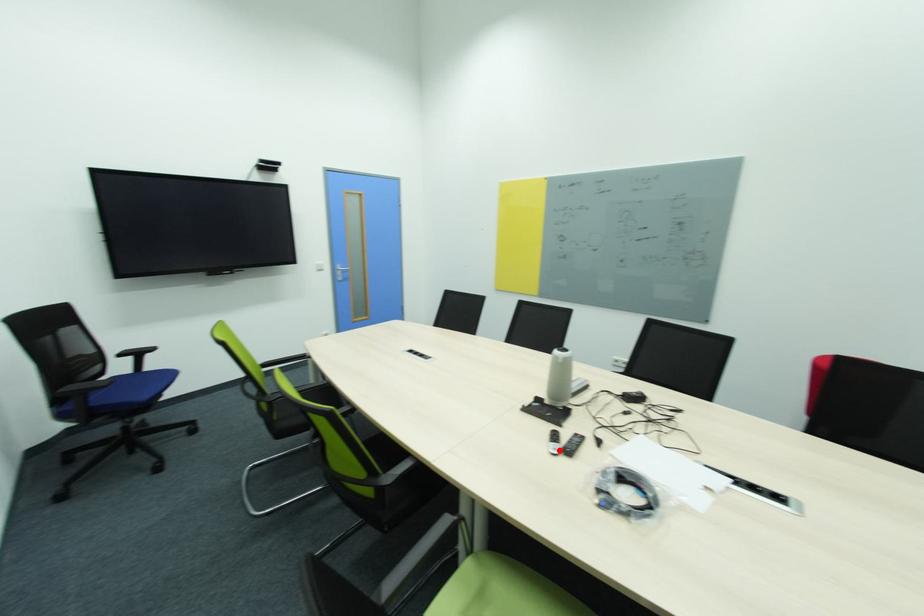
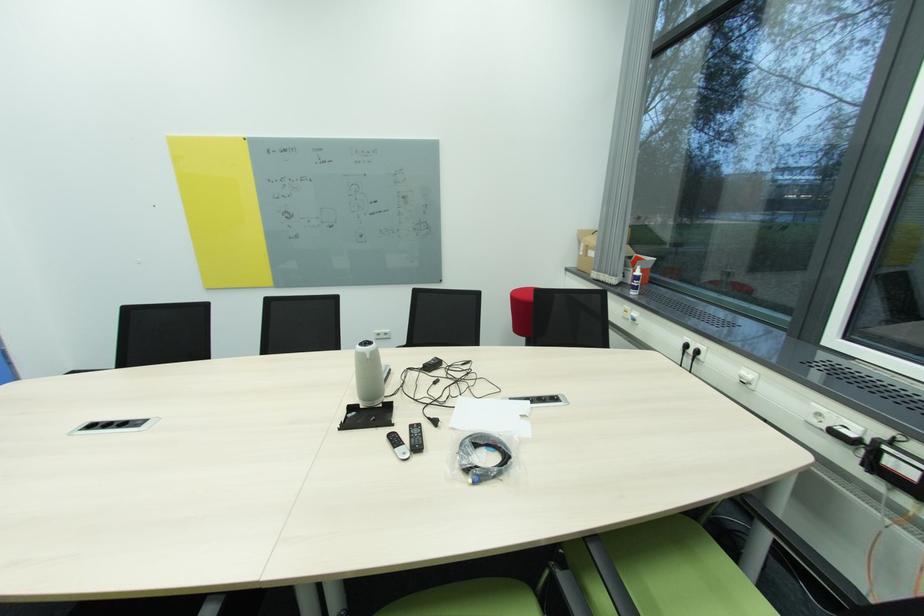
The point at the highlighted location is marked in the first image. Where is the corresponding point in the second image?

(408, 455)